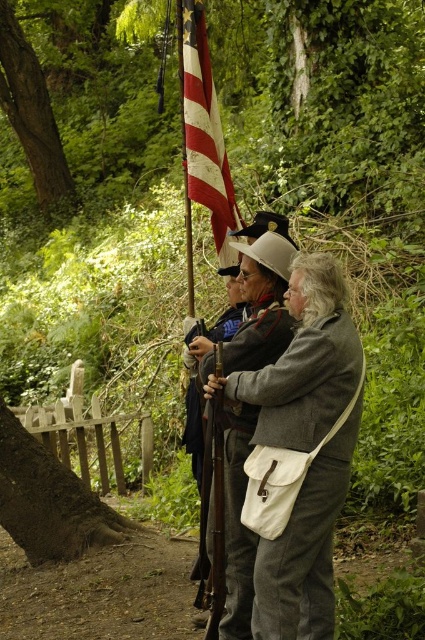
Question: Estimate the real-world distances between objects in this image. Which object is closer to the gray wool coat at center?

Choices:
 (A) american flag at center
 (B) wooden rifle at center
 (C) shiny brown leather sword at center

Answer: (C)

Question: Is gray wool coat at center further to camera compared to american flag at center?

Choices:
 (A) yes
 (B) no

Answer: (B)

Question: Among these objects, which one is farthest from the camera?

Choices:
 (A) shiny brown leather sword at center
 (B) wooden rifle at center
 (C) american flag at center

Answer: (C)

Question: Which point appears closest to the camera in this image?

Choices:
 (A) (232, 524)
 (B) (218, 584)
 (C) (229, 177)
 (D) (193, 458)

Answer: (B)

Question: Can you confirm if gray wool coat at center is positioned below shiny brown leather sword at center?

Choices:
 (A) yes
 (B) no

Answer: (A)

Question: Is american flag at center positioned in front of wooden rifle at center?

Choices:
 (A) no
 (B) yes

Answer: (A)